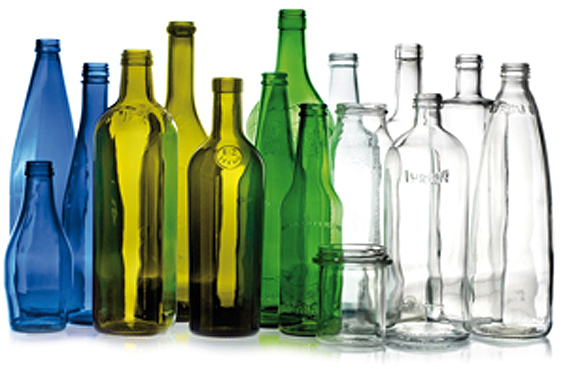
Locate an element on the screen. clear glass container is located at coordinates (341, 87), (409, 77), (469, 85), (522, 134), (428, 147), (356, 277).